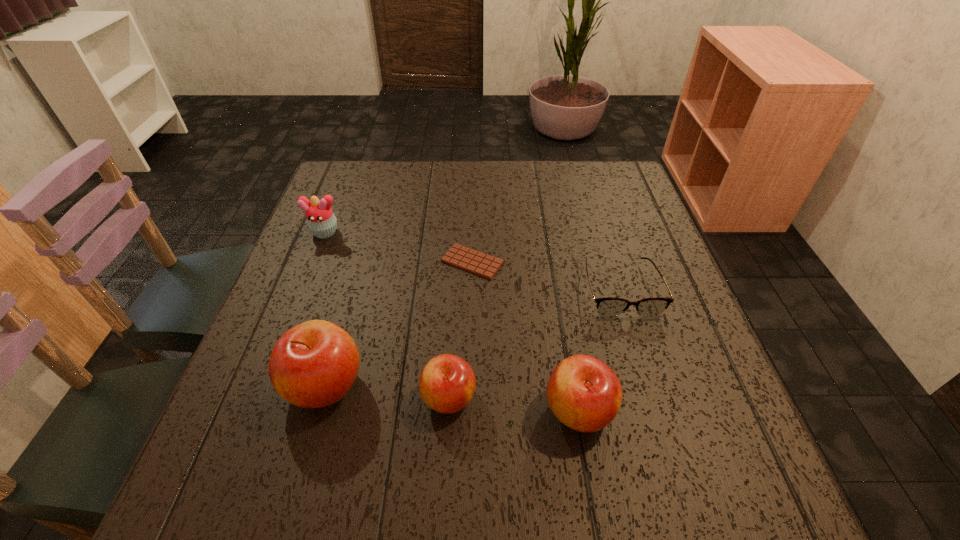
The apples are evenly distributed in the image. To maintain this, where would you place another apple on the right? Please point to a free space. Please provide its 2D coordinates. Your answer should be formatted as a tuple, i.e. [(x, y)], where the tuple contains the x and y coordinates of a point satisfying the conditions above.

[(714, 423)]